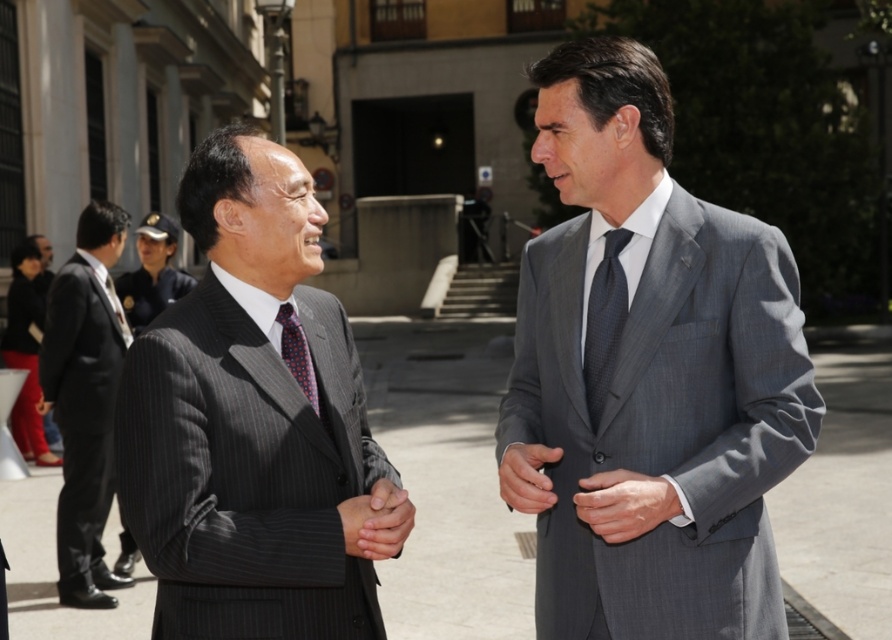
The height and width of the screenshot is (640, 892). I want to click on black pinstripe suit at left, so click(85, 400).

Does black pinstripe suit at left appear on the right side of polka dot silk tie at left?

Incorrect, black pinstripe suit at left is not on the right side of polka dot silk tie at left.

Where is `black pinstripe suit at left`? black pinstripe suit at left is located at coordinates (85, 400).

Does point (734, 404) come in front of point (100, 388)?

Yes, it is in front of point (100, 388).

This screenshot has width=892, height=640. I want to click on gray pinstripe suit at right, so (648, 374).

The width and height of the screenshot is (892, 640). I want to click on gray pinstripe suit at right, so click(x=648, y=374).

Describe the element at coordinates (604, 323) in the screenshot. The width and height of the screenshot is (892, 640). I see `dark gray textured tie at center` at that location.

Is dark gray textured tie at center further to the viewer compared to polka dot silk tie at left?

No, it is in front of polka dot silk tie at left.

Who is more forward, (615,244) or (116,298)?

Point (615,244)

You are a GUI agent. You are given a task and a screenshot of the screen. Output one action in this format:
    pyautogui.click(x=<x>, y=<y>)
    Task: Click on the dark gray textured tie at center
    
    Given the screenshot: What is the action you would take?
    pyautogui.click(x=604, y=323)